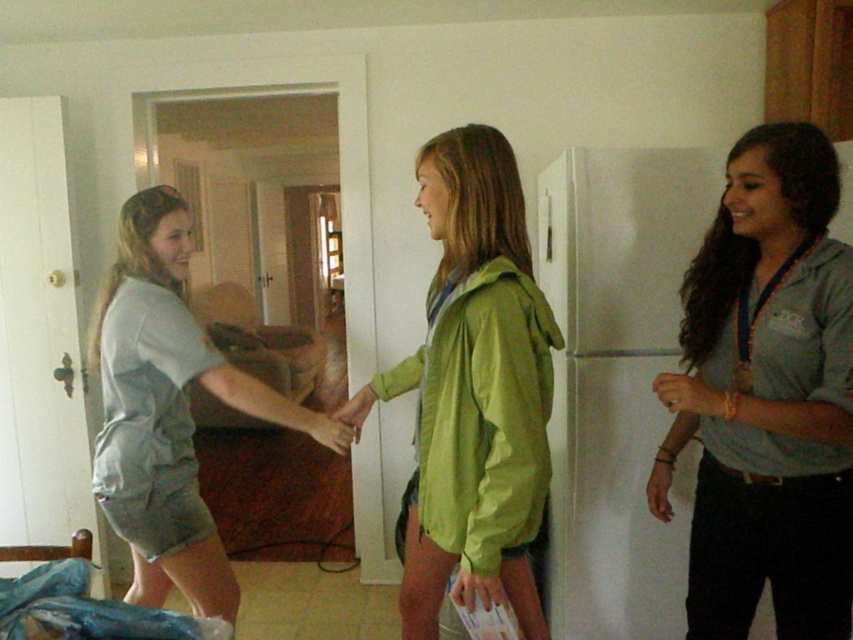
You are organizing a clothing rack in the kitchen and need to arrange the green matte jacket at center and the gray cotton shirt at left based on their positions in the image. Which clothing item should be placed to the right side of the other?

The green matte jacket at center should be placed to the right side of the gray cotton shirt at left because in the image, the green matte jacket at center is positioned on the right side of gray cotton shirt at left.

You are standing in the kitchen and see the gray fabric shirt at right and the green matte jacket at center. Which clothing item is covering part of the other?

The gray fabric shirt at right is positioned over the green matte jacket at center, so it is covering part of it.

You are organizing a clothing rack in the kitchen and see the green matte jacket at center and the gray cotton shirt at left. Which clothing item is positioned lower on the rack?

The green matte jacket at center is positioned lower on the rack since it is below the gray cotton shirt at left.